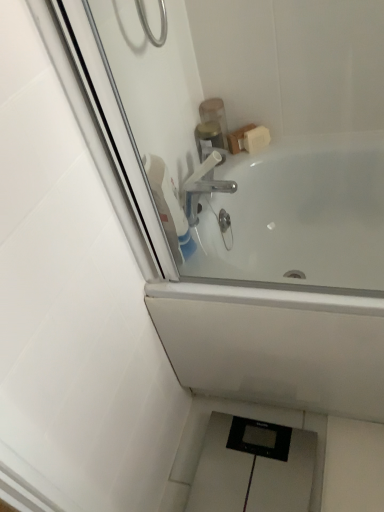
Describe the element at coordinates (215, 115) in the screenshot. This screenshot has height=512, width=384. I see `translucent plastic soap dispenser at upper center, placed as the 1th toiletry when sorted from top to bottom` at that location.

The height and width of the screenshot is (512, 384). What do you see at coordinates (286, 281) in the screenshot?
I see `white glossy bathtub at upper center` at bounding box center [286, 281].

Where is `polished chrome faucet at upper center`? This screenshot has width=384, height=512. polished chrome faucet at upper center is located at coordinates (225, 227).

The width and height of the screenshot is (384, 512). I want to click on translucent plastic soap dispenser at upper center, positioned as the second toiletry in bottom-to-top order, so click(x=215, y=115).

From the image's perspective, is polished chrome faucet at upper center below translucent plastic soap dispenser at upper center, placed as the 1th toiletry when sorted from top to bottom?

Yes.

From a real-world perspective, is polished chrome faucet at upper center positioned above or below translucent plastic soap dispenser at upper center, placed as the 1th toiletry when sorted from top to bottom?

In terms of real-world spatial position, polished chrome faucet at upper center is below translucent plastic soap dispenser at upper center, placed as the 1th toiletry when sorted from top to bottom.

Does point (222, 210) come closer to viewer compared to point (224, 132)?

Yes, point (222, 210) is closer to viewer.

Which is in front, point (351, 282) or point (213, 180)?

The point (351, 282) is more forward.

Considering the sizes of white glossy bathtub at upper center and white plastic tap at upper center in the image, is white glossy bathtub at upper center taller or shorter than white plastic tap at upper center?

Clearly, white glossy bathtub at upper center is taller compared to white plastic tap at upper center.

Looking at this image, how different are the orientations of white glossy bathtub at upper center and white plastic tap at upper center in degrees?

white glossy bathtub at upper center and white plastic tap at upper center are facing 88.4 degrees away from each other.

The width and height of the screenshot is (384, 512). In order to click on tap on the left of the white glossy bathtub at upper center in this screenshot , I will do `click(204, 186)`.

Is translucent plastic container at upper center, positioned as the second toiletry in top-to-bottom order, oriented away from white glossy bathtub at upper center?

No, translucent plastic container at upper center, positioned as the second toiletry in top-to-bottom order, is not facing the opposite direction of white glossy bathtub at upper center.

Considering the relative sizes of translucent plastic container at upper center, positioned as the second toiletry in top-to-bottom order, and white glossy bathtub at upper center in the image provided, is translucent plastic container at upper center, positioned as the second toiletry in top-to-bottom order, shorter than white glossy bathtub at upper center?

Correct, translucent plastic container at upper center, positioned as the second toiletry in top-to-bottom order, is not as tall as white glossy bathtub at upper center.

From a real-world perspective, between translucent plastic container at upper center, positioned as the second toiletry in top-to-bottom order, and white glossy bathtub at upper center, who is vertically lower?

white glossy bathtub at upper center, from a real-world perspective.

Is translucent plastic container at upper center, the 1th toiletry positioned from the bottom, not close to white glossy bathtub at upper center?

Actually, translucent plastic container at upper center, the 1th toiletry positioned from the bottom, and white glossy bathtub at upper center are a little close together.

Considering the sizes of objects translucent plastic soap dispenser at upper center, positioned as the second toiletry in bottom-to-top order, and white plastic tap at upper center in the image provided, who is thinner, translucent plastic soap dispenser at upper center, positioned as the second toiletry in bottom-to-top order, or white plastic tap at upper center?

translucent plastic soap dispenser at upper center, positioned as the second toiletry in bottom-to-top order, is thinner.

Is translucent plastic soap dispenser at upper center, positioned as the second toiletry in bottom-to-top order, facing towards white plastic tap at upper center?

No, translucent plastic soap dispenser at upper center, positioned as the second toiletry in bottom-to-top order, is not oriented towards white plastic tap at upper center.

In terms of height, does translucent plastic soap dispenser at upper center, placed as the 1th toiletry when sorted from top to bottom, look taller or shorter compared to white plastic tap at upper center?

Clearly, translucent plastic soap dispenser at upper center, placed as the 1th toiletry when sorted from top to bottom, is taller compared to white plastic tap at upper center.

Who is more distant, translucent plastic soap dispenser at upper center, placed as the 1th toiletry when sorted from top to bottom, or white plastic tap at upper center?

translucent plastic soap dispenser at upper center, placed as the 1th toiletry when sorted from top to bottom, is further from the camera.

How much distance is there between white plastic tap at upper center and polished chrome faucet at upper center?

white plastic tap at upper center is 11.40 centimeters away from polished chrome faucet at upper center.

In terms of width, does white plastic tap at upper center look wider or thinner when compared to polished chrome faucet at upper center?

Clearly, white plastic tap at upper center has more width compared to polished chrome faucet at upper center.

Is white plastic tap at upper center placed right next to polished chrome faucet at upper center?

No, white plastic tap at upper center is not beside polished chrome faucet at upper center.

Is white glossy bathtub at upper center taller or shorter than polished chrome faucet at upper center?

Considering their sizes, white glossy bathtub at upper center has more height than polished chrome faucet at upper center.

Is white glossy bathtub at upper center not inside polished chrome faucet at upper center?

Yes, white glossy bathtub at upper center is not within polished chrome faucet at upper center.

Where is `plumbing fixture that is behind the white glossy bathtub at upper center`? The height and width of the screenshot is (512, 384). plumbing fixture that is behind the white glossy bathtub at upper center is located at coordinates (225, 227).

From a real-world perspective, which object stands above the other?

In real-world perspective, translucent plastic soap dispenser at upper center, placed as the 1th toiletry when sorted from top to bottom, is above.

Is white glossy bathtub at upper center smaller than translucent plastic soap dispenser at upper center, positioned as the second toiletry in bottom-to-top order?

No, white glossy bathtub at upper center is not smaller than translucent plastic soap dispenser at upper center, positioned as the second toiletry in bottom-to-top order.

How distant is white glossy bathtub at upper center from translucent plastic soap dispenser at upper center, positioned as the second toiletry in bottom-to-top order?

A distance of 20.79 inches exists between white glossy bathtub at upper center and translucent plastic soap dispenser at upper center, positioned as the second toiletry in bottom-to-top order.

Which is correct: white glossy bathtub at upper center is inside translucent plastic soap dispenser at upper center, placed as the 1th toiletry when sorted from top to bottom, or outside of it?

white glossy bathtub at upper center exists outside the volume of translucent plastic soap dispenser at upper center, placed as the 1th toiletry when sorted from top to bottom.

Which toiletry is the 2nd one when counting from the back of the polished chrome faucet at upper center? Please provide its 2D coordinates.

[(215, 115)]

Find the location of `tap above the white glossy bathtub at upper center (from the image's perspective)`. tap above the white glossy bathtub at upper center (from the image's perspective) is located at coordinates (x=204, y=186).

Looking at the image, which one is located further to polished chrome faucet at upper center, translucent plastic soap dispenser at upper center, placed as the 1th toiletry when sorted from top to bottom, or white plastic tap at upper center?

The object further to polished chrome faucet at upper center is translucent plastic soap dispenser at upper center, placed as the 1th toiletry when sorted from top to bottom.

In the scene shown: When comparing their distances from white glossy bathtub at upper center, does polished chrome faucet at upper center or white plastic tap at upper center seem closer?

white plastic tap at upper center lies closer to white glossy bathtub at upper center than the other object.

When comparing their distances from polished chrome faucet at upper center, does white glossy bathtub at upper center or translucent plastic soap dispenser at upper center, placed as the 1th toiletry when sorted from top to bottom, seem closer?

white glossy bathtub at upper center lies closer to polished chrome faucet at upper center than the other object.

Estimate the real-world distances between objects in this image. Which object is further from translucent plastic container at upper center, positioned as the second toiletry in top-to-bottom order, white glossy bathtub at upper center or translucent plastic soap dispenser at upper center, positioned as the second toiletry in bottom-to-top order?

Based on the image, white glossy bathtub at upper center appears to be further to translucent plastic container at upper center, positioned as the second toiletry in top-to-bottom order.

Which object lies further to the anchor point polished chrome faucet at upper center, white glossy bathtub at upper center or white plastic tap at upper center?

white glossy bathtub at upper center is further to polished chrome faucet at upper center.

Considering their positions, is translucent plastic soap dispenser at upper center, placed as the 1th toiletry when sorted from top to bottom, positioned further to white glossy bathtub at upper center than polished chrome faucet at upper center?

translucent plastic soap dispenser at upper center, placed as the 1th toiletry when sorted from top to bottom.

From the picture: From the image, which object appears to be farther from white plastic tap at upper center, polished chrome faucet at upper center or translucent plastic container at upper center, the 1th toiletry positioned from the bottom?

translucent plastic container at upper center, the 1th toiletry positioned from the bottom, is positioned further to the anchor white plastic tap at upper center.

Estimate the real-world distances between objects in this image. Which object is further from white glossy bathtub at upper center, white plastic tap at upper center or polished chrome faucet at upper center?

The object further to white glossy bathtub at upper center is polished chrome faucet at upper center.

I want to click on tap between white glossy bathtub at upper center and translucent plastic soap dispenser at upper center, positioned as the second toiletry in bottom-to-top order, from front to back, so click(204, 186).

Identify the location of tap between translucent plastic soap dispenser at upper center, positioned as the second toiletry in bottom-to-top order, and polished chrome faucet at upper center from top to bottom. This screenshot has height=512, width=384. (204, 186).

The height and width of the screenshot is (512, 384). I want to click on toiletry between white glossy bathtub at upper center and translucent plastic soap dispenser at upper center, placed as the 1th toiletry when sorted from top to bottom, in the front-back direction, so click(208, 138).

Find the location of a particular element. plumbing fixture between white glossy bathtub at upper center and translucent plastic container at upper center, the 1th toiletry positioned from the bottom, from front to back is located at coordinates (225, 227).